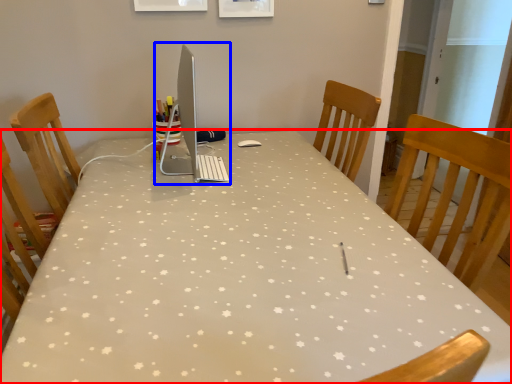
Question: Which point is further to the camera, table (highlighted by a red box) or desktop computer (highlighted by a blue box)?

Choices:
 (A) table
 (B) desktop computer

Answer: (B)